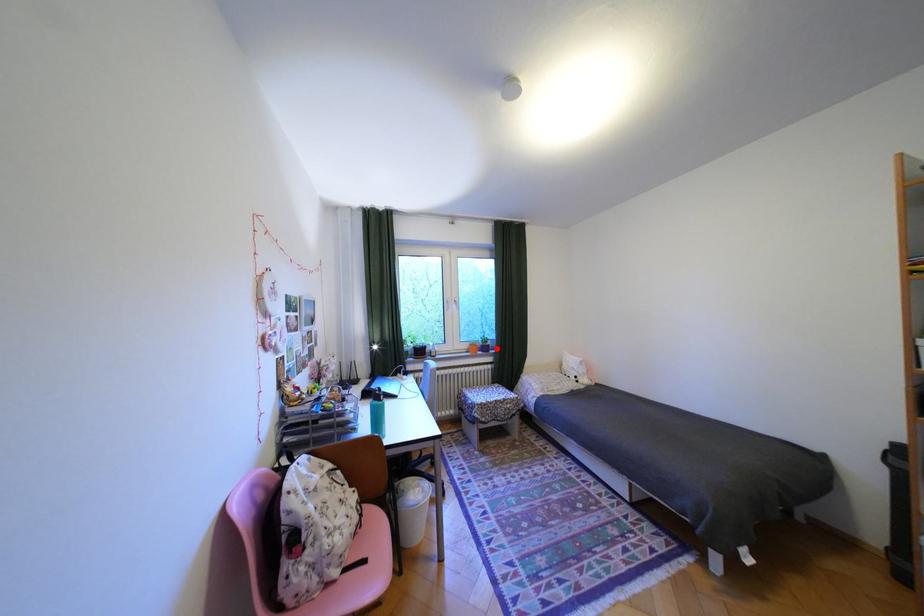
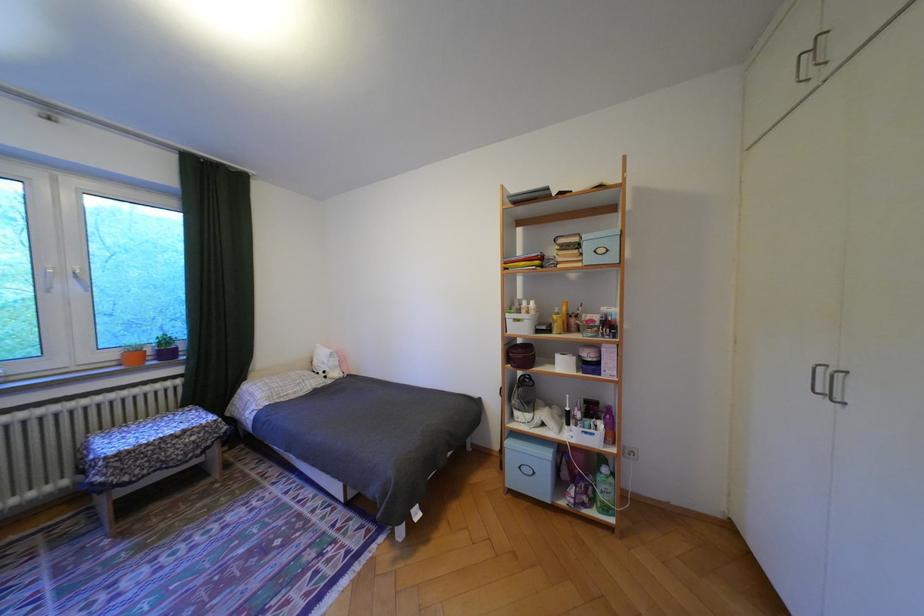
Question: I am providing you with two images of the same scene from different viewpoints. Image1 has a red point marked. In image2, the corresponding 3D location appears at what relative position? Reply with the corresponding letter.

Choices:
 (A) Closer
 (B) Farther

Answer: (A)